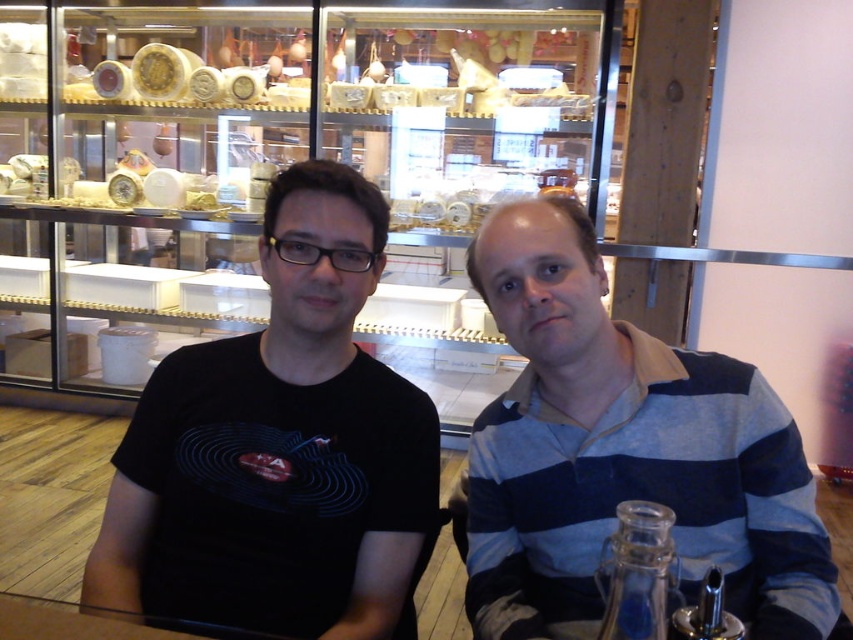
Does black matte shirt at center have a lesser height compared to blue striped shirt at center?

No, black matte shirt at center is not shorter than blue striped shirt at center.

Between black matte shirt at center and blue striped shirt at center, which one is positioned lower?

blue striped shirt at center

The image size is (853, 640). I want to click on black matte shirt at center, so click(x=279, y=448).

Is black matte t-shirt at left shorter than blue striped shirt at center?

Incorrect, black matte t-shirt at left's height does not fall short of blue striped shirt at center's.

Does black matte t-shirt at left appear under blue striped shirt at center?

Incorrect, black matte t-shirt at left is not positioned below blue striped shirt at center.

Is point (364, 628) positioned after point (527, 536)?

No, it is not.

Find the location of a particular element. black matte t-shirt at left is located at coordinates (x=280, y=449).

This screenshot has height=640, width=853. What do you see at coordinates (279, 448) in the screenshot?
I see `black matte shirt at center` at bounding box center [279, 448].

Does black matte shirt at center have a larger size compared to black matte t-shirt at left?

Correct, black matte shirt at center is larger in size than black matte t-shirt at left.

Measure the distance between point (293, 381) and camera.

Point (293, 381) and camera are 1.19 meters apart.

The image size is (853, 640). Identify the location of black matte shirt at center. (279, 448).